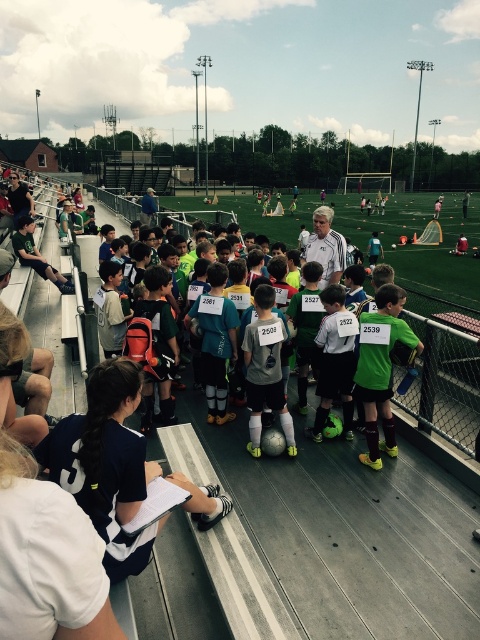
Question: Can you confirm if green jersey at center is positioned below teal jersey at center?

Choices:
 (A) no
 (B) yes

Answer: (B)

Question: Which point is closer to the camera?

Choices:
 (A) matte black jacket at left
 (B) matte gray jersey at center
 (C) dark blue jersey at lower left

Answer: (C)

Question: Can you confirm if dark blue jersey at lower left is positioned to the left of matte black jacket at left?

Choices:
 (A) no
 (B) yes

Answer: (A)

Question: Does dark blue jersey at lower left have a greater width compared to green jersey at center?

Choices:
 (A) yes
 (B) no

Answer: (A)

Question: Which is farther from the teal jersey at center?

Choices:
 (A) matte black jacket at left
 (B) dark blue jersey at lower left
 (C) matte gray jersey at center

Answer: (A)

Question: Estimate the real-world distances between objects in this image. Which object is farther from the matte black jacket at left?

Choices:
 (A) matte gray jersey at center
 (B) green jersey at center

Answer: (B)